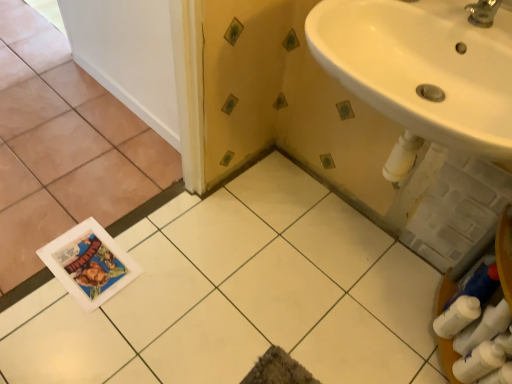
Where is `free space above white glossy tile at lower left, which appears as the 1th ceramic tile when viewed from the left (from a real-world perspective)`? The image size is (512, 384). free space above white glossy tile at lower left, which appears as the 1th ceramic tile when viewed from the left (from a real-world perspective) is located at coordinates point(47,115).